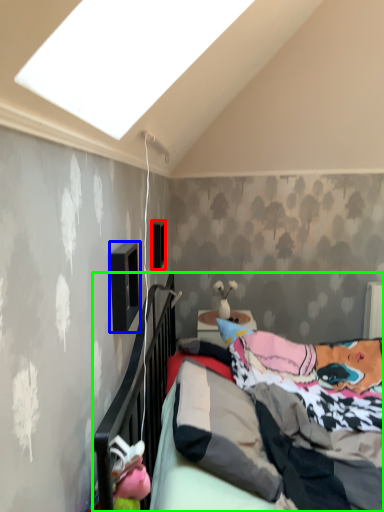
Question: Which object is the closest to the window (highlighted by a red box)? Choose among these: window (highlighted by a blue box) or bed (highlighted by a green box).

Choices:
 (A) window
 (B) bed

Answer: (B)